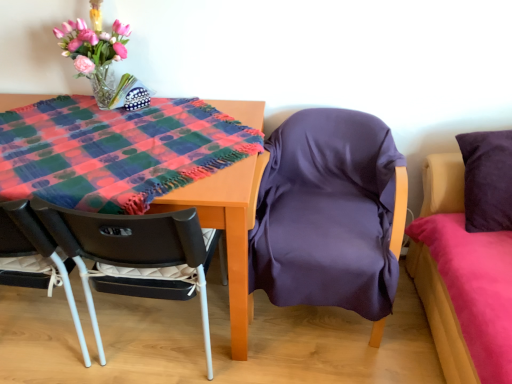
Image resolution: width=512 pixels, height=384 pixels. Describe the element at coordinates (227, 230) in the screenshot. I see `wooden table at center` at that location.

What do you see at coordinates (467, 257) in the screenshot?
I see `purple satin bed at right` at bounding box center [467, 257].

What is the approximate height of purple satin chair at center, marked as the first chair in a right-to-left arrangement?

purple satin chair at center, marked as the first chair in a right-to-left arrangement, is 30.68 inches tall.

This screenshot has width=512, height=384. I want to click on matte black chair at lower left, which appears as the 2th chair when viewed from the right, so click(131, 249).

Describe the element at coordinates (131, 249) in the screenshot. I see `matte black chair at lower left, which is counted as the 1th chair, starting from the left` at that location.

Image resolution: width=512 pixels, height=384 pixels. I want to click on wooden table at center, so click(227, 230).

Is wooden table at center directly adjacent to matte black chair at lower left, which appears as the 2th chair when viewed from the right?

No, wooden table at center is not in contact with matte black chair at lower left, which appears as the 2th chair when viewed from the right.

Which object is positioned more to the right, wooden table at center or matte black chair at lower left, which is counted as the 1th chair, starting from the left?

matte black chair at lower left, which is counted as the 1th chair, starting from the left.

Is wooden table at center taller than matte black chair at lower left, which appears as the 2th chair when viewed from the right?

No.

Does purple satin bed at right turn towards matte black chair at lower left, which appears as the 2th chair when viewed from the right?

Yes, purple satin bed at right is oriented towards matte black chair at lower left, which appears as the 2th chair when viewed from the right.

Considering the positions of objects purple satin bed at right and matte black chair at lower left, which appears as the 2th chair when viewed from the right, in the image provided, who is behind, purple satin bed at right or matte black chair at lower left, which appears as the 2th chair when viewed from the right,?

Positioned behind is matte black chair at lower left, which appears as the 2th chair when viewed from the right.

From the image's perspective, which object appears higher, purple satin bed at right or matte black chair at lower left, which is counted as the 1th chair, starting from the left?

purple satin bed at right appears higher in the image.

Is purple satin bed at right next to matte black chair at lower left, which is counted as the 1th chair, starting from the left?

purple satin bed at right and matte black chair at lower left, which is counted as the 1th chair, starting from the left, are clearly separated.

Is matte black chair at lower left, which is counted as the 1th chair, starting from the left, inside the boundaries of wooden table at center, or outside?

matte black chair at lower left, which is counted as the 1th chair, starting from the left, is located beyond the bounds of wooden table at center.

Is matte black chair at lower left, which appears as the 2th chair when viewed from the right, thinner than wooden table at center?

Yes.

Which is closer, [80,239] or [245,252]?

The point [80,239] is closer.

Does point (501, 371) lie in front of point (327, 164)?

Yes, point (501, 371) is in front of point (327, 164).

Is purple satin bed at right shorter than purple satin chair at center, the 2th chair when ordered from left to right?

No.

Find the location of a particular element. bed on the right of purple satin chair at center, marked as the first chair in a right-to-left arrangement is located at coordinates (467, 257).

Choose the correct answer: Is purple satin bed at right inside purple satin chair at center, marked as the first chair in a right-to-left arrangement, or outside it?

purple satin bed at right cannot be found inside purple satin chair at center, marked as the first chair in a right-to-left arrangement.

Could you tell me if matte black chair at lower left, which is counted as the 1th chair, starting from the left, is turned towards purple satin bed at right?

No, matte black chair at lower left, which is counted as the 1th chair, starting from the left, is not oriented towards purple satin bed at right.

From their relative heights in the image, would you say matte black chair at lower left, which appears as the 2th chair when viewed from the right, is taller or shorter than purple satin bed at right?

Considering their sizes, matte black chair at lower left, which appears as the 2th chair when viewed from the right, has less height than purple satin bed at right.

Which object is further away from the camera, matte black chair at lower left, which appears as the 2th chair when viewed from the right, or purple satin bed at right?

matte black chair at lower left, which appears as the 2th chair when viewed from the right, is further away from the camera.

Is wooden table at center aimed at purple satin bed at right?

No, wooden table at center is not facing towards purple satin bed at right.

Would you consider wooden table at center to be distant from purple satin bed at right?

No, wooden table at center is not far away from purple satin bed at right.

This screenshot has width=512, height=384. In order to click on bed lying in front of the wooden table at center in this screenshot , I will do `click(467, 257)`.

Considering the positions of objects matte black chair at lower left, which is counted as the 1th chair, starting from the left, and purple satin chair at center, marked as the first chair in a right-to-left arrangement, in the image provided, who is behind, matte black chair at lower left, which is counted as the 1th chair, starting from the left, or purple satin chair at center, marked as the first chair in a right-to-left arrangement,?

purple satin chair at center, marked as the first chair in a right-to-left arrangement, is behind.

Would you consider matte black chair at lower left, which is counted as the 1th chair, starting from the left, to be distant from purple satin chair at center, the 2th chair when ordered from left to right?

Actually, matte black chair at lower left, which is counted as the 1th chair, starting from the left, and purple satin chair at center, the 2th chair when ordered from left to right, are a little close together.

In the scene shown: Could purple satin chair at center, marked as the first chair in a right-to-left arrangement, be considered to be inside matte black chair at lower left, which appears as the 2th chair when viewed from the right?

No, matte black chair at lower left, which appears as the 2th chair when viewed from the right, does not contain purple satin chair at center, marked as the first chair in a right-to-left arrangement.

Looking at their sizes, would you say matte black chair at lower left, which appears as the 2th chair when viewed from the right, is wider or thinner than purple satin chair at center, the 2th chair when ordered from left to right?

matte black chair at lower left, which appears as the 2th chair when viewed from the right, is thinner than purple satin chair at center, the 2th chair when ordered from left to right.

Image resolution: width=512 pixels, height=384 pixels. In order to click on the 2nd chair below when counting from the wooden table at center (from the image's perspective) in this screenshot , I will do `click(131, 249)`.

Locate an element on the screen. the 1st chair behind the purple satin bed at right is located at coordinates (131, 249).

Looking at the image, which one is located further to purple satin chair at center, the 2th chair when ordered from left to right, wooden table at center or purple satin bed at right?

wooden table at center is positioned further to the anchor purple satin chair at center, the 2th chair when ordered from left to right.

Which object lies nearer to the anchor point purple satin chair at center, marked as the first chair in a right-to-left arrangement, matte black chair at lower left, which appears as the 2th chair when viewed from the right, or purple satin bed at right?

purple satin bed at right.

From the image, which object appears to be farther from matte black chair at lower left, which appears as the 2th chair when viewed from the right, purple satin chair at center, marked as the first chair in a right-to-left arrangement, or wooden table at center?

purple satin chair at center, marked as the first chair in a right-to-left arrangement, lies further to matte black chair at lower left, which appears as the 2th chair when viewed from the right, than the other object.

Which object lies further to the anchor point purple satin chair at center, the 2th chair when ordered from left to right, wooden table at center or matte black chair at lower left, which is counted as the 1th chair, starting from the left?

matte black chair at lower left, which is counted as the 1th chair, starting from the left.

From the image, which object appears to be nearer to matte black chair at lower left, which appears as the 2th chair when viewed from the right, wooden table at center or purple satin chair at center, marked as the first chair in a right-to-left arrangement?

Based on the image, wooden table at center appears to be nearer to matte black chair at lower left, which appears as the 2th chair when viewed from the right.

When comparing their distances from wooden table at center, does matte black chair at lower left, which appears as the 2th chair when viewed from the right, or purple satin chair at center, the 2th chair when ordered from left to right, seem closer?

matte black chair at lower left, which appears as the 2th chair when viewed from the right.

When comparing their distances from matte black chair at lower left, which is counted as the 1th chair, starting from the left, does wooden table at center or purple satin bed at right seem further?

Among the two, purple satin bed at right is located further to matte black chair at lower left, which is counted as the 1th chair, starting from the left.

Considering their positions, is matte black chair at lower left, which appears as the 2th chair when viewed from the right, positioned closer to wooden table at center than purple satin bed at right?

The object closer to wooden table at center is matte black chair at lower left, which appears as the 2th chair when viewed from the right.

Where is `chair between matte black chair at lower left, which is counted as the 1th chair, starting from the left, and purple satin bed at right`? The image size is (512, 384). chair between matte black chair at lower left, which is counted as the 1th chair, starting from the left, and purple satin bed at right is located at coordinates (330, 215).

What are the coordinates of `chair between wooden table at center and purple satin chair at center, marked as the first chair in a right-to-left arrangement, from left to right` in the screenshot? It's located at (131, 249).